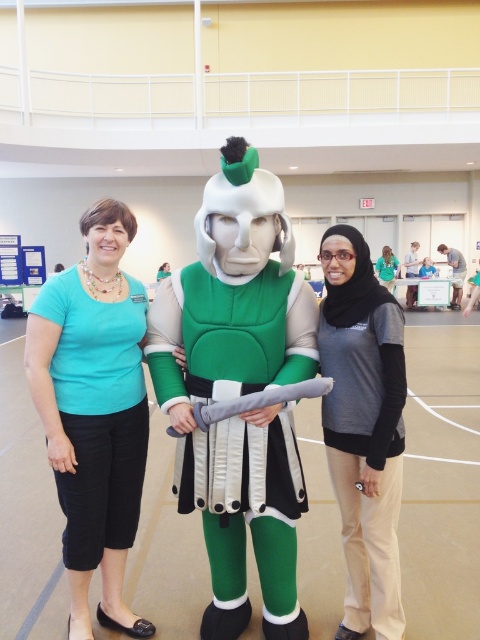
Question: Which point is closer to the camera?

Choices:
 (A) matte green shirt at center
 (B) matte teal shirt at center
 (C) matte gray sweater at center

Answer: (C)

Question: Is matte gray sweater at center thinner than matte green shirt at center?

Choices:
 (A) yes
 (B) no

Answer: (A)

Question: Can you confirm if green matte costume at center is positioned below matte gray sweater at center?

Choices:
 (A) yes
 (B) no

Answer: (B)

Question: Among these objects, which one is farthest from the camera?

Choices:
 (A) matte gray sweater at center
 (B) matte teal shirt at center
 (C) matte green shirt at center
 (D) green matte costume at center

Answer: (C)

Question: Does matte teal shirt at center appear on the left side of matte green shirt at center?

Choices:
 (A) yes
 (B) no

Answer: (A)

Question: Estimate the real-world distances between objects in this image. Which object is farther from the matte teal shirt at center?

Choices:
 (A) matte gray sweater at center
 (B) matte green shirt at center
 (C) green matte costume at center

Answer: (B)